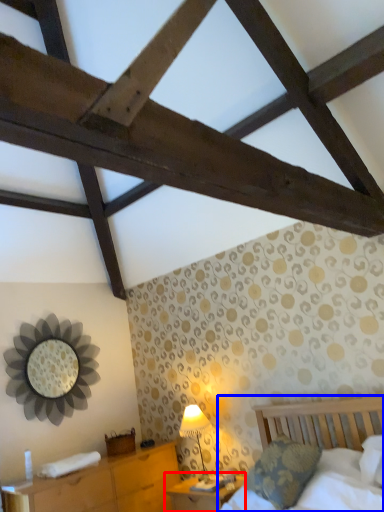
Question: Which object is further to the camera taking this photo, nightstand (highlighted by a red box) or bed (highlighted by a blue box)?

Choices:
 (A) nightstand
 (B) bed

Answer: (A)